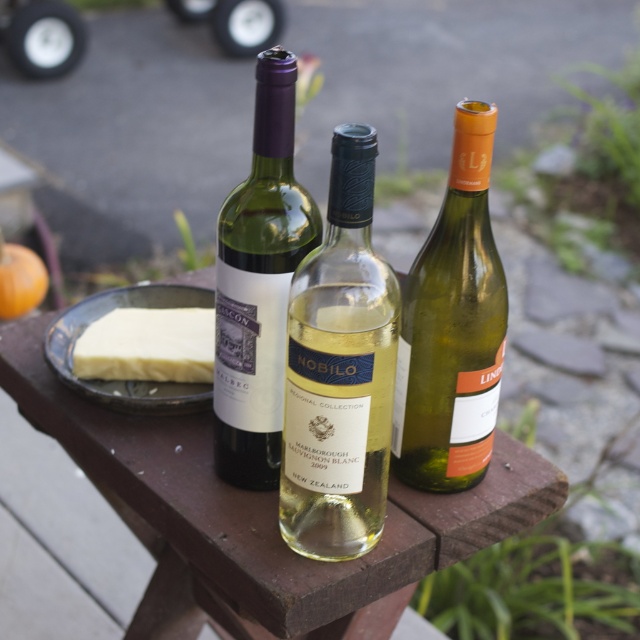
You are standing at the edge of a garden and see the wooden table at center and the green glass bottle at center. Which object is closer to you?

The wooden table at center is closer to you because it is further to the viewer than the green glass bottle at center.

You are setting up for a picnic and have a wooden table at center and a matte glass wine bottle at center. If you want to place the bottle on the table, will the bottle fit entirely on the table without overhanging the edges?

The wooden table at center is wider than the matte glass wine bottle at center, so the bottle will fit entirely on the table without overhanging the edges.

You are at a picnic table with two bottles in front of you. The translucent glass bottle at center and the green glass bottle at center. Which one is smaller?

The translucent glass bottle at center is smaller than the green glass bottle at center.